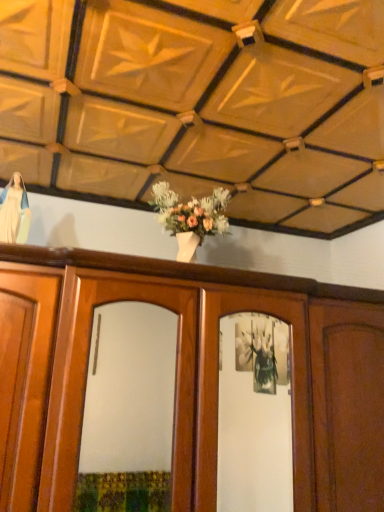
This screenshot has width=384, height=512. I want to click on white glossy statue at upper left, so click(14, 216).

The height and width of the screenshot is (512, 384). What do you see at coordinates (14, 216) in the screenshot?
I see `white glossy statue at upper left` at bounding box center [14, 216].

What do you see at coordinates (201, 369) in the screenshot?
I see `wooden cabinet at center` at bounding box center [201, 369].

Locate an element on the screen. The height and width of the screenshot is (512, 384). wooden cabinet at center is located at coordinates tap(201, 369).

Identify the location of white glossy statue at upper left. (14, 216).

Is white glossy statue at upper left to the left of wooden cabinet at center from the viewer's perspective?

Indeed, white glossy statue at upper left is positioned on the left side of wooden cabinet at center.

Does white glossy statue at upper left lie in front of wooden cabinet at center?

No, it is not.

Which point is more forward, [12,191] or [198,372]?

Positioned in front is point [198,372].

From the image's perspective, which is above, white glossy statue at upper left or wooden cabinet at center?

white glossy statue at upper left appears higher in the image.

From a real-world perspective, does white glossy statue at upper left stand above wooden cabinet at center?

Yes, from a real-world perspective, white glossy statue at upper left is above wooden cabinet at center.

Does white glossy statue at upper left have a greater width compared to wooden cabinet at center?

Incorrect, the width of white glossy statue at upper left does not surpass that of wooden cabinet at center.

Can you confirm if white glossy statue at upper left is shorter than wooden cabinet at center?

Indeed, white glossy statue at upper left has a lesser height compared to wooden cabinet at center.

Looking at the image, does white glossy statue at upper left seem bigger or smaller compared to wooden cabinet at center?

In the image, white glossy statue at upper left appears to be smaller than wooden cabinet at center.

Would you say wooden cabinet at center is part of white glossy statue at upper left's contents?

No, wooden cabinet at center is not surrounded by white glossy statue at upper left.

Is there a large distance between white glossy statue at upper left and wooden cabinet at center?

No, white glossy statue at upper left is not far from wooden cabinet at center.

Looking at this image, is white glossy statue at upper left oriented towards wooden cabinet at center?

No, white glossy statue at upper left does not turn towards wooden cabinet at center.

You are a GUI agent. You are given a task and a screenshot of the screen. Output one action in this format:
    pyautogui.click(x=<x>, y=<y>)
    Task: Click on the cabinetry that is under the white glossy statue at upper left (from a real-world perspective)
    This screenshot has width=384, height=512.
    Given the screenshot: What is the action you would take?
    pyautogui.click(x=201, y=369)

Is wooden cabinet at center at the left side of white glossy statue at upper left?

No.

In the image, is wooden cabinet at center positioned in front of or behind white glossy statue at upper left?

Clearly, wooden cabinet at center is in front of white glossy statue at upper left.

Which is in front, point (351, 417) or point (10, 232)?

The point (10, 232) is closer to the camera.

Consider the image. From the image's perspective, is wooden cabinet at center over white glossy statue at upper left?

No.

From the picture: From a real-world perspective, who is located higher, wooden cabinet at center or white glossy statue at upper left?

white glossy statue at upper left is physically above.

Between wooden cabinet at center and white glossy statue at upper left, which one has larger width?

Wider between the two is wooden cabinet at center.

Does wooden cabinet at center have a lesser height compared to white glossy statue at upper left?

No.

Does wooden cabinet at center have a larger size compared to white glossy statue at upper left?

Yes.

Is wooden cabinet at center inside the boundaries of white glossy statue at upper left, or outside?

wooden cabinet at center is not enclosed by white glossy statue at upper left.

Is there a large distance between wooden cabinet at center and white glossy statue at upper left?

No.

Is wooden cabinet at center aimed at white glossy statue at upper left?

No, wooden cabinet at center is not aimed at white glossy statue at upper left.

What are the coordinates of `robe above the wooden cabinet at center (from the image's perspective)` in the screenshot? It's located at (14, 216).

The height and width of the screenshot is (512, 384). I want to click on robe that is behind the wooden cabinet at center, so click(x=14, y=216).

Identify the location of robe on the left of the wooden cabinet at center. Image resolution: width=384 pixels, height=512 pixels. tap(14, 216).